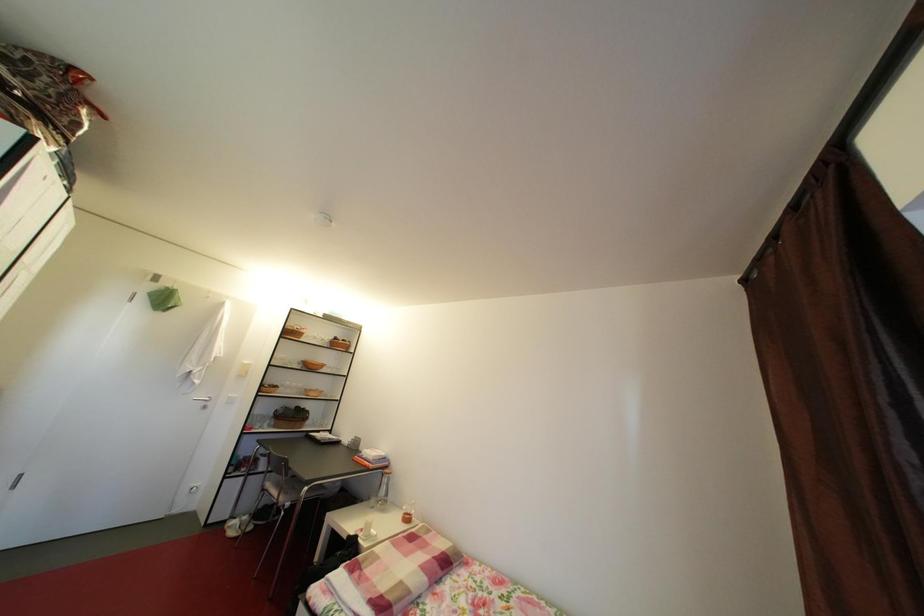
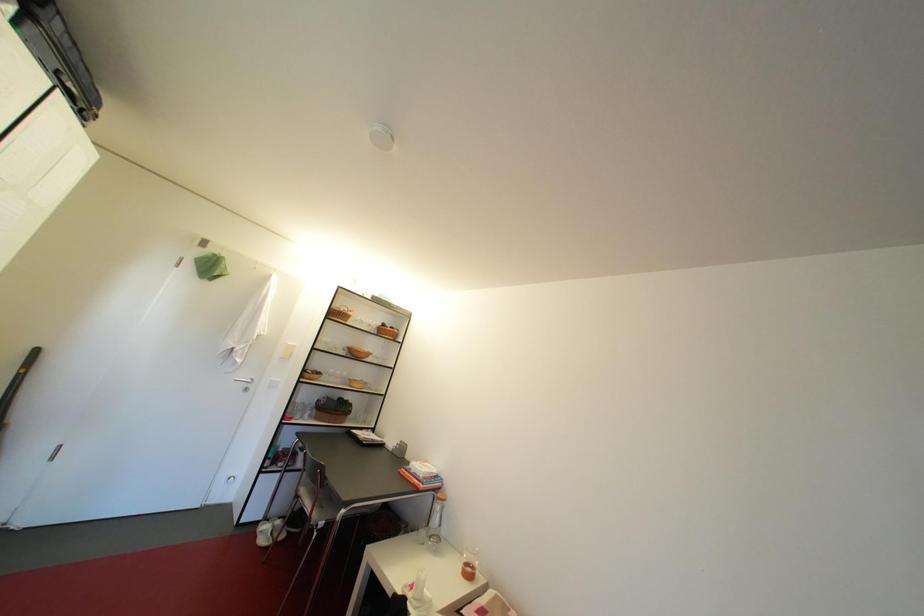
Looking at this image, in a continuous first-person perspective shot, in which direction is the camera moving?

The movement direction of the cameraman is left, forward.